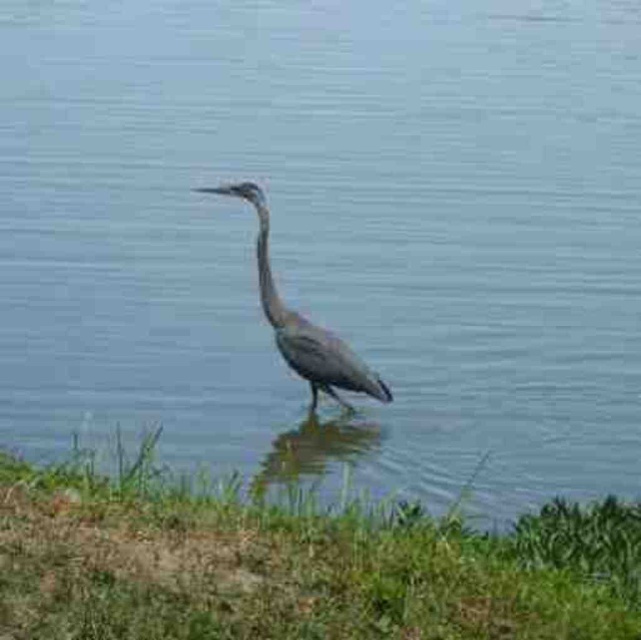
Question: Observing the image, what is the correct spatial positioning of green grass at lower left in reference to gray matte bird at center?

Choices:
 (A) left
 (B) right

Answer: (B)

Question: Which point is closer to the camera?

Choices:
 (A) (260, 282)
 (B) (229, 618)

Answer: (B)

Question: Is green grass at lower left positioned in front of gray matte bird at center?

Choices:
 (A) yes
 (B) no

Answer: (A)

Question: Is green grass at lower left thinner than gray matte bird at center?

Choices:
 (A) no
 (B) yes

Answer: (A)

Question: Which point appears farthest from the camera in this image?

Choices:
 (A) (263, 266)
 (B) (4, 634)

Answer: (A)